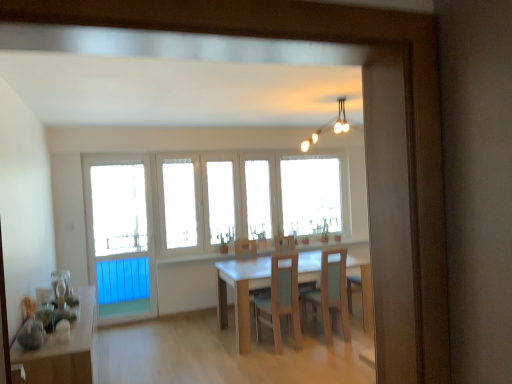
Where is `white glass windows at center`? white glass windows at center is located at coordinates (243, 198).

How much space does wooden table at lower left, which ranks as the 1th table in left-to-right order, occupy vertically?

wooden table at lower left, which ranks as the 1th table in left-to-right order, is 35.71 inches in height.

The width and height of the screenshot is (512, 384). Find the location of `blue plastic screen door at left`. blue plastic screen door at left is located at coordinates click(x=120, y=237).

What do you see at coordinates (245, 249) in the screenshot? Image resolution: width=512 pixels, height=384 pixels. I see `light brown wooden chair at center` at bounding box center [245, 249].

This screenshot has height=384, width=512. In order to click on wooden table at center, the second table viewed from the front in this screenshot , I will do `click(240, 293)`.

Consider the image. Which of these two, wooden table at lower left, which ranks as the 1th table in left-to-right order, or wooden table at center, the second table viewed from the front, stands shorter?

wooden table at center, the second table viewed from the front.

Considering the relative sizes of wooden table at lower left, which ranks as the 1th table in left-to-right order, and wooden table at center, the 1th table when ordered from right to left, in the image provided, is wooden table at lower left, which ranks as the 1th table in left-to-right order, thinner than wooden table at center, the 1th table when ordered from right to left,?

Yes.

Where is `the 1st table in front when counting from the light brown wooden chair at center`? Image resolution: width=512 pixels, height=384 pixels. the 1st table in front when counting from the light brown wooden chair at center is located at coordinates pyautogui.click(x=240, y=293).

Consider the image. Can you confirm if wooden table at center, the second table viewed from the front, is bigger than light brown wooden chair at center?

Correct, wooden table at center, the second table viewed from the front, is larger in size than light brown wooden chair at center.

How distant is wooden table at center, the 1th table when ordered from right to left, from light brown wooden chair at center?

The distance of wooden table at center, the 1th table when ordered from right to left, from light brown wooden chair at center is 96.86 centimeters.

From the picture: Considering the sizes of objects wooden table at center, the 1th table when ordered from right to left, and light brown wooden chair at center in the image provided, who is thinner, wooden table at center, the 1th table when ordered from right to left, or light brown wooden chair at center?

Thinner between the two is light brown wooden chair at center.

Considering the positions of point (234, 301) and point (197, 233), is point (234, 301) closer or farther from the camera than point (197, 233)?

Point (234, 301) appears to be closer to the viewer than point (197, 233).

Considering the positions of objects wooden table at center, positioned as the second table in left-to-right order, and white glass windows at center in the image provided, who is more to the left, wooden table at center, positioned as the second table in left-to-right order, or white glass windows at center?

white glass windows at center.

Between wooden table at center, the 1th table when ordered from right to left, and white glass windows at center, which one has less height?

With less height is wooden table at center, the 1th table when ordered from right to left.

Looking at their sizes, would you say wooden table at center, acting as the first table starting from the back, is wider or thinner than white glass windows at center?

wooden table at center, acting as the first table starting from the back, is wider than white glass windows at center.

Is light brown wooden chair at center oriented away from light wood chair at center, the 1th chair in the right-to-left sequence?

No, light wood chair at center, the 1th chair in the right-to-left sequence, is not at the back of light brown wooden chair at center.

Is the depth of light brown wooden chair at center less than that of light wood chair at center, the 1th chair in the right-to-left sequence?

That is False.

Is light brown wooden chair at center shorter than light wood chair at center, positioned as the 2th chair in left-to-right order?

No, light brown wooden chair at center is not shorter than light wood chair at center, positioned as the 2th chair in left-to-right order.

From a real-world perspective, which object rests below the other?

From a 3D spatial view, light wood chair at center, positioned as the 2th chair in left-to-right order, is below.

Is light wood chair at center, positioned as the 2th chair in left-to-right order, not inside light wood/matte chair at center, the first chair in the left-to-right sequence?

Indeed, light wood chair at center, positioned as the 2th chair in left-to-right order, is completely outside light wood/matte chair at center, the first chair in the left-to-right sequence.

Is light wood chair at center, the 1th chair in the right-to-left sequence, at the left side of light wood/matte chair at center, the first chair in the left-to-right sequence?

No.

Considering the sizes of objects light wood chair at center, positioned as the 2th chair in left-to-right order, and light wood/matte chair at center, which is counted as the 2th chair, starting from the right, in the image provided, who is smaller, light wood chair at center, positioned as the 2th chair in left-to-right order, or light wood/matte chair at center, which is counted as the 2th chair, starting from the right,?

Smaller between the two is light wood chair at center, positioned as the 2th chair in left-to-right order.

From the image's perspective, is light wood chair at center, the 1th chair in the right-to-left sequence, below light wood/matte chair at center, the first chair in the left-to-right sequence?

Incorrect, from the image's perspective, light wood chair at center, the 1th chair in the right-to-left sequence, is higher than light wood/matte chair at center, the first chair in the left-to-right sequence.

Can you confirm if wooden table at lower left, positioned as the 2th table in back-to-front order, is positioned to the left of blue plastic screen door at left?

Incorrect, wooden table at lower left, positioned as the 2th table in back-to-front order, is not on the left side of blue plastic screen door at left.

Is wooden table at lower left, positioned as the 2th table in back-to-front order, not near blue plastic screen door at left?

Yes, wooden table at lower left, positioned as the 2th table in back-to-front order, is far from blue plastic screen door at left.

Looking at this image, from a real-world perspective, which object rests below the other?

wooden table at lower left, the first table viewed from the front, is physically lower.

Which of these two, wooden table at lower left, which ranks as the 1th table in left-to-right order, or blue plastic screen door at left, stands shorter?

wooden table at lower left, which ranks as the 1th table in left-to-right order.

From a real-world perspective, who is located higher, wooden table at lower left, the first table viewed from the front, or white glass windows at center?

In real-world perspective, white glass windows at center is above.

Is wooden table at lower left, the first table viewed from the front, surrounding white glass windows at center?

Actually, white glass windows at center is outside wooden table at lower left, the first table viewed from the front.

Considering the relative positions of wooden table at lower left, the first table viewed from the front, and white glass windows at center in the image provided, is wooden table at lower left, the first table viewed from the front, in front of white glass windows at center?

Yes, wooden table at lower left, the first table viewed from the front, is in front of white glass windows at center.

Is point (64, 379) farther from viewer compared to point (198, 163)?

That is False.

Find the location of a particular element. The width and height of the screenshot is (512, 384). table located on the left of wooden table at center, the second table viewed from the front is located at coordinates (65, 350).

Identify the location of armchair above the wooden table at center, positioned as the second table in left-to-right order (from the image's perspective). This screenshot has width=512, height=384. (245, 249).

When comparing their distances from white glass windows at center, does light brown wooden chair at center or wooden table at lower left, positioned as the 2th table in back-to-front order, seem closer?

Among the two, light brown wooden chair at center is located nearer to white glass windows at center.

Looking at the image, which one is located closer to wooden table at center, the 1th table when ordered from right to left, white glass windows at center or blue plastic screen door at left?

white glass windows at center is positioned closer to the anchor wooden table at center, the 1th table when ordered from right to left.

From the image, which object appears to be farther from light brown wooden chair at center, light wood chair at center, positioned as the 2th chair in left-to-right order, or blue plastic screen door at left?

Based on the image, blue plastic screen door at left appears to be further to light brown wooden chair at center.

From the image, which object appears to be nearer to light brown wooden chair at center, wooden table at lower left, which ranks as the 1th table in left-to-right order, or blue plastic screen door at left?

blue plastic screen door at left is closer to light brown wooden chair at center.

Looking at the image, which one is located closer to light wood chair at center, the 1th chair in the right-to-left sequence, wooden table at center, the 1th table when ordered from right to left, or blue plastic screen door at left?

Based on the image, wooden table at center, the 1th table when ordered from right to left, appears to be nearer to light wood chair at center, the 1th chair in the right-to-left sequence.

Looking at the image, which one is located closer to light wood chair at center, positioned as the 2th chair in left-to-right order, wooden table at lower left, the first table viewed from the front, or wooden table at center, the 1th table when ordered from right to left?

wooden table at center, the 1th table when ordered from right to left, is positioned closer to the anchor light wood chair at center, positioned as the 2th chair in left-to-right order.

From the image, which object appears to be farther from wooden table at center, the second table viewed from the front, white glass windows at center or light wood chair at center, positioned as the 2th chair in left-to-right order?

white glass windows at center lies further to wooden table at center, the second table viewed from the front, than the other object.

Considering their positions, is white glass windows at center positioned further to light wood/matte chair at center, which is counted as the 2th chair, starting from the right, than wooden table at lower left, positioned as the 2th table in back-to-front order?

wooden table at lower left, positioned as the 2th table in back-to-front order, is further to light wood/matte chair at center, which is counted as the 2th chair, starting from the right.

Where is `table between wooden table at lower left, which ranks as the 1th table in left-to-right order, and light wood chair at center, positioned as the 2th chair in left-to-right order, from front to back`? table between wooden table at lower left, which ranks as the 1th table in left-to-right order, and light wood chair at center, positioned as the 2th chair in left-to-right order, from front to back is located at coordinates (240, 293).

Image resolution: width=512 pixels, height=384 pixels. In order to click on window between blue plastic screen door at left and light wood/matte chair at center, which is counted as the 2th chair, starting from the right, from left to right in this screenshot , I will do (243, 198).

Identify the location of armchair between blue plastic screen door at left and light wood/matte chair at center, which is counted as the 2th chair, starting from the right, from left to right. (245, 249).

The width and height of the screenshot is (512, 384). In order to click on armchair between wooden table at lower left, positioned as the 2th table in back-to-front order, and blue plastic screen door at left in the front-back direction in this screenshot , I will do `click(245, 249)`.